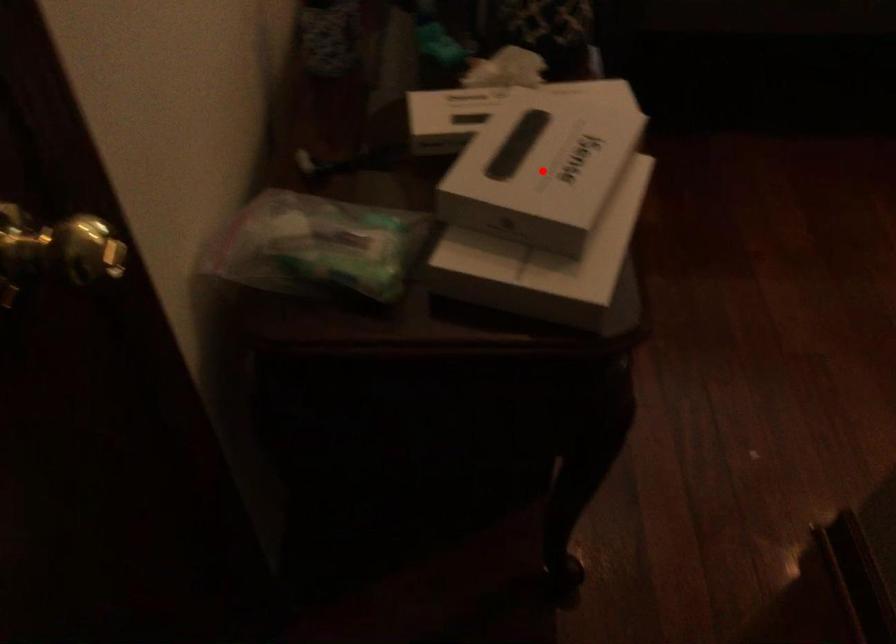
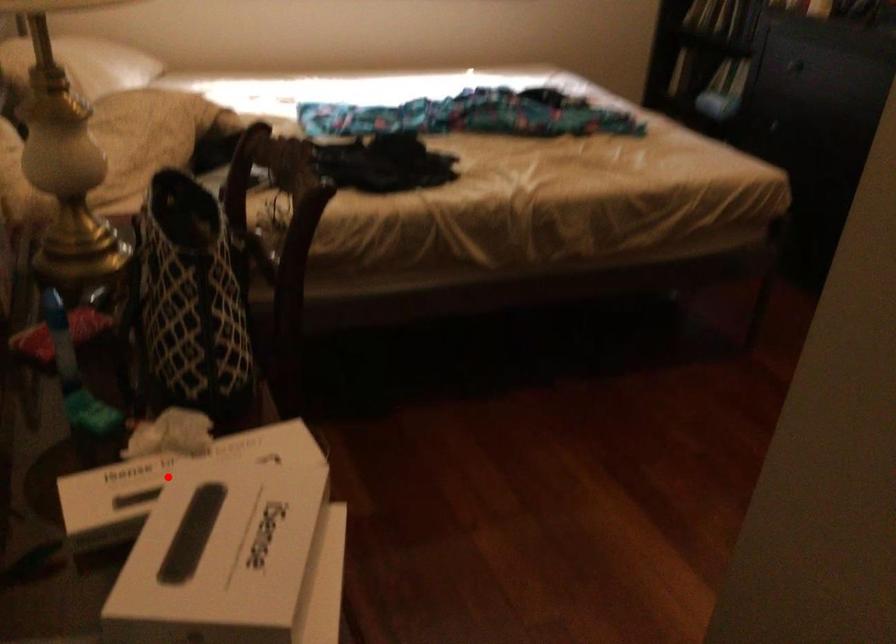
I am providing you with two images of the same scene from different viewpoints. A red point is marked on the first image and another point is marked on the second image. Are the points marked in image1 and image2 representing the same 3D position?

No